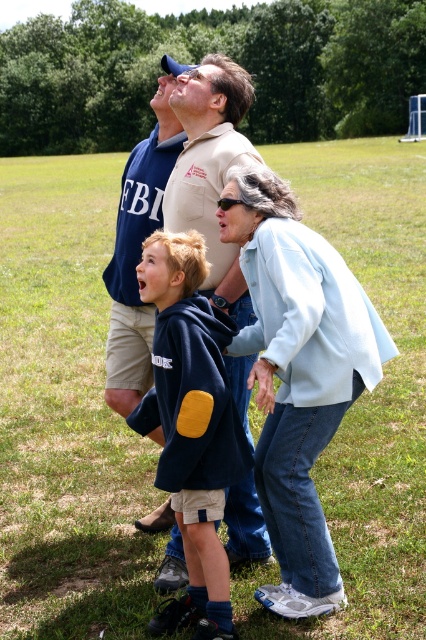
Can you confirm if matte khaki shirt at center is positioned to the left of matte blue shirt at center?

In fact, matte khaki shirt at center is to the right of matte blue shirt at center.

Who is more distant from viewer, (x=172, y=547) or (x=141, y=236)?

The point (x=141, y=236) is more distant.

At what (x,y) coordinates should I click in order to perform the action: click on matte khaki shirt at center. Please return your answer as a coordinate pair (x, y). The height and width of the screenshot is (640, 426). Looking at the image, I should click on (210, 170).

Is point (282, 374) positioned in front of point (157, 144)?

That is True.

Find the location of `light blue denim jacket at center`. light blue denim jacket at center is located at coordinates (298, 374).

Between point (305, 404) and point (146, 348), which one is positioned in front?

Point (305, 404) is in front.

Image resolution: width=426 pixels, height=640 pixels. In order to click on light blue denim jacket at center in this screenshot , I will do `click(298, 374)`.

Is light blue denim jacket at center in front of matte khaki shirt at center?

Yes, light blue denim jacket at center is closer to the viewer.

Who is more forward, [250,244] or [178,221]?

Point [250,244]

Is point (259, 192) closer to camera compared to point (204, 228)?

Yes.

Image resolution: width=426 pixels, height=640 pixels. I want to click on light blue denim jacket at center, so click(x=298, y=374).